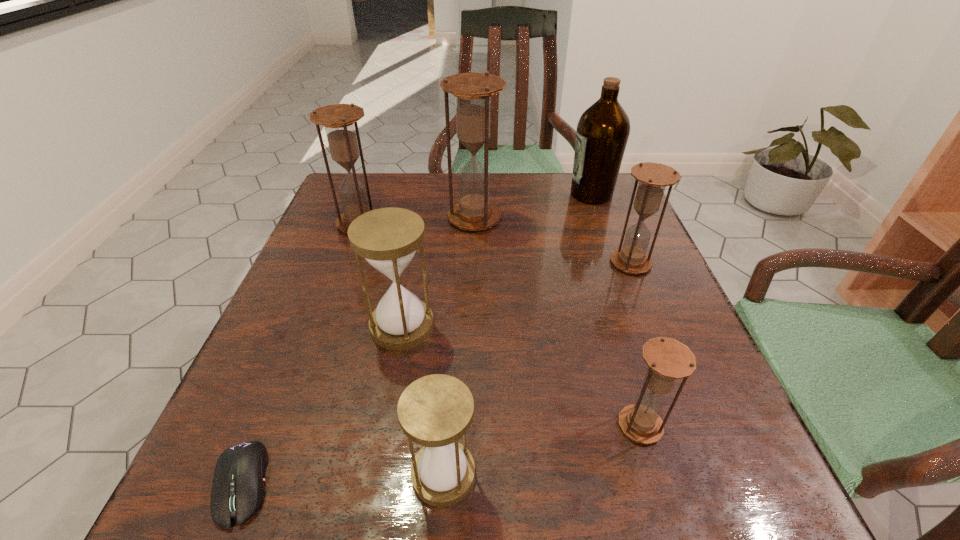
Where is `object present at the far left corner`? object present at the far left corner is located at coordinates (339, 119).

Find the location of a particular element. The height and width of the screenshot is (540, 960). object at the near left corner is located at coordinates (238, 490).

In order to click on object at the far right corner in this screenshot , I will do `click(602, 133)`.

You are a GUI agent. You are given a task and a screenshot of the screen. Output one action in this format:
    pyautogui.click(x=<x>, y=<y>)
    Task: Click on the free space at the far edge of the desktop
    Image resolution: width=960 pixels, height=540 pixels.
    Given the screenshot: What is the action you would take?
    pyautogui.click(x=431, y=181)

This screenshot has height=540, width=960. Find the location of `free space at the near edge of the desktop`. free space at the near edge of the desktop is located at coordinates (496, 508).

In the image, there is a desktop. Identify the location of vacant area at the left edge. This screenshot has width=960, height=540. (348, 357).

Locate an element on the screen. The height and width of the screenshot is (540, 960). vacant point at the right edge is located at coordinates (608, 328).

The image size is (960, 540). Identify the location of vacant space at the far right corner. (593, 207).

This screenshot has height=540, width=960. Identify the location of blank area at the near right corner. (723, 499).

Locate an element on the screen. The height and width of the screenshot is (540, 960). free space between the nearest brown hourglass and the brown olive oil is located at coordinates [615, 310].